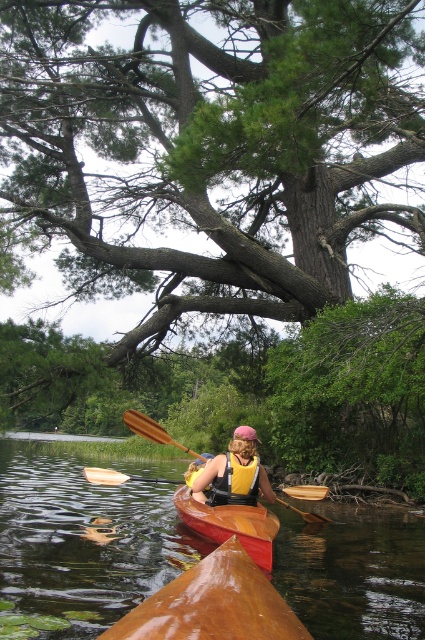
You are a kayaker in the image and want to know where your wooden paddle at center is located. Please provide its coordinates as a point in the format of x,y between 0 and 1. The kayaker is facing forward in the image.

The wooden paddle at center is located at coordinates (x=152, y=429).

You are a kayaker in the scene and need to grab your paddle. There are two paddles at the center of the image, a wooden paddle at center and a brown wood paddle at center. Which paddle is closer to you?

The wooden paddle at center is 37.41 inches away from the brown wood paddle at center. Since both paddles are at the center, their distance from you depends on their positions relative to each other. However, the description only provides the distance between them, not their individual distances from you. Therefore, it is impossible to determine which paddle is closer to you based on the given information.

You are a photographer trying to capture the kayaker in the scene. You want to ensure both the yellow life vest at center and the wooden paddle at lower center are clearly visible in your shot. Given their sizes, which object should you focus on first to ensure it fits within the frame?

The yellow life vest at center occupies less space than the wooden paddle at lower center, so you should focus on capturing the wooden paddle at lower center first since it takes up more space and needs to be positioned carefully to fit within the frame.